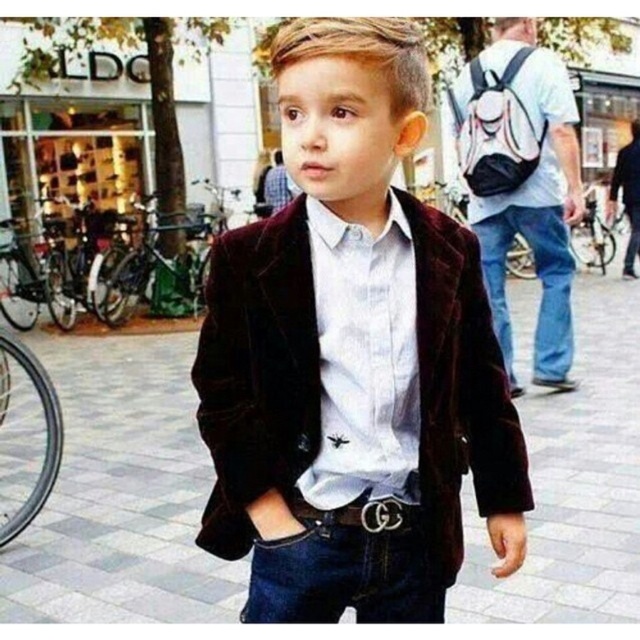
In order to click on denim jeans at center in this screenshot , I will do `click(346, 566)`.

Can you confirm if denim jeans at center is positioned to the left of blue denim jeans at right?

Yes, denim jeans at center is to the left of blue denim jeans at right.

Between point (420, 556) and point (493, 288), which one is positioned in front?

Point (420, 556)

You are a GUI agent. You are given a task and a screenshot of the screen. Output one action in this format:
    pyautogui.click(x=<x>, y=<y>)
    Task: Click on the denim jeans at center
    
    Given the screenshot: What is the action you would take?
    pyautogui.click(x=346, y=566)

Does velvet brown blazer at center have a larger size compared to black leather belt at center?

Indeed, velvet brown blazer at center has a larger size compared to black leather belt at center.

Between point (484, 480) and point (301, 509), which one is positioned in front?

Positioned in front is point (301, 509).

I want to click on velvet brown blazer at center, so click(x=257, y=372).

Locate an element on the screen. This screenshot has height=640, width=640. velvet brown blazer at center is located at coordinates (257, 372).

Is blue denim jeans at right thinner than black leather belt at center?

No.

Who is positioned more to the right, blue denim jeans at right or black leather belt at center?

blue denim jeans at right

Consider the image. Who is more distant from viewer, (564, 333) or (332, 512)?

The point (564, 333) is behind.

You are a GUI agent. You are given a task and a screenshot of the screen. Output one action in this format:
    pyautogui.click(x=<x>, y=<y>)
    Task: Click on the blue denim jeans at right
    This screenshot has height=640, width=640.
    Given the screenshot: What is the action you would take?
    pyautogui.click(x=540, y=280)